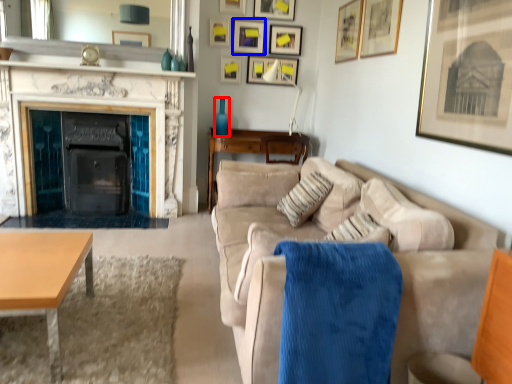
Question: Among these objects, which one is nearest to the camera, vase (highlighted by a red box) or picture frame (highlighted by a blue box)?

Choices:
 (A) vase
 (B) picture frame

Answer: (A)